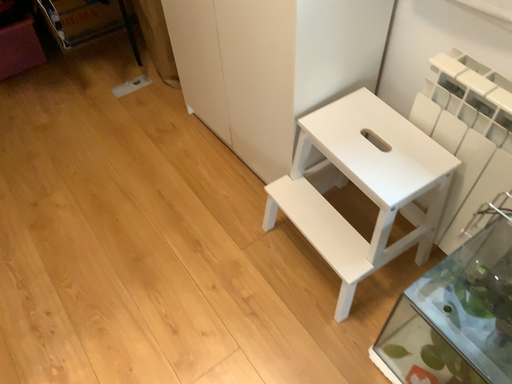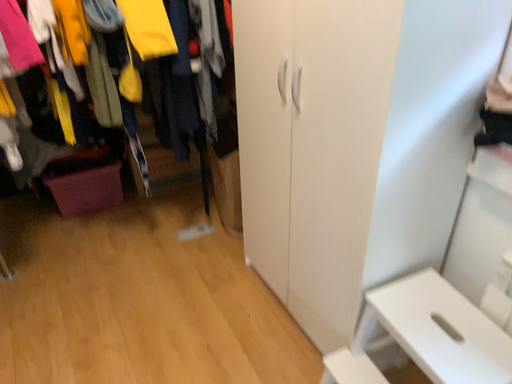
Question: How did the camera likely rotate when shooting the video?

Choices:
 (A) rotated downward
 (B) rotated upward

Answer: (B)